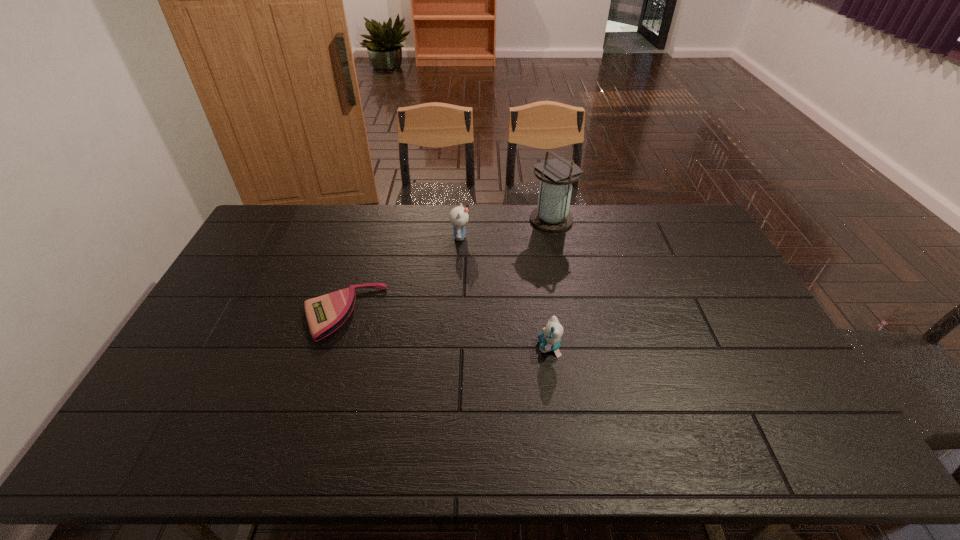
Locate an element on the screen. vacant position located on the face of the shorter kitten is located at coordinates (502, 347).

At what (x,y) coordinates should I click in order to perform the action: click on free space located 0.290m on the face of the shorter kitten. Please return your answer as a coordinate pair (x, y). This screenshot has width=960, height=540. Looking at the image, I should click on point(435,347).

Locate an element on the screen. This screenshot has height=540, width=960. vacant space located on the right of the leftmost object is located at coordinates (411, 314).

In order to click on lantern situated at the far edge in this screenshot , I will do click(x=552, y=214).

Identify the location of kitten at the far edge. This screenshot has height=540, width=960. (458, 217).

Find the location of a particular element. This screenshot has width=960, height=540. free space at the far edge of the desktop is located at coordinates (633, 234).

This screenshot has height=540, width=960. In order to click on vacant region at the near edge of the desktop in this screenshot , I will do `click(271, 444)`.

What are the coordinates of `vacant space at the left edge` in the screenshot? It's located at (237, 355).

The image size is (960, 540). Identify the location of free space at the right edge of the desktop. (758, 326).

The width and height of the screenshot is (960, 540). Identify the location of free space at the far left corner. (x=299, y=221).